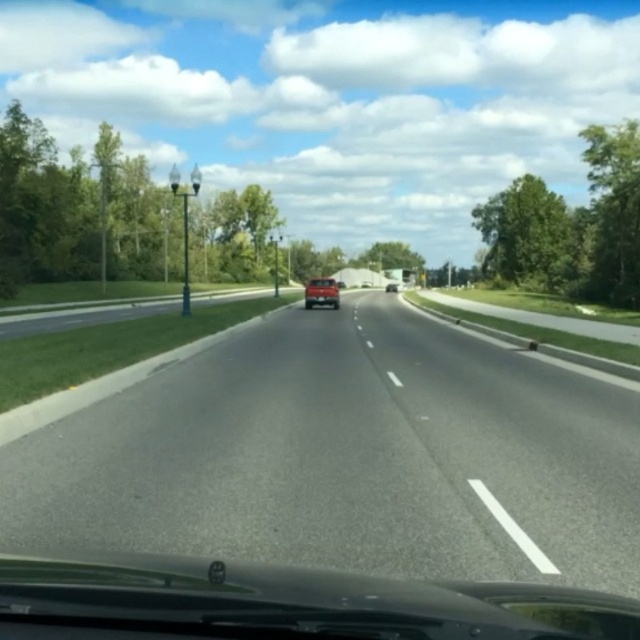
Question: Which object is closer to the camera taking this photo?

Choices:
 (A) asphalt road at center
 (B) matte black suv at center
 (C) shiny red car at center

Answer: (A)

Question: Which point is closer to the camera?

Choices:
 (A) (396, 289)
 (B) (10, 493)

Answer: (B)

Question: Is asphalt road at center wider than matte black suv at center?

Choices:
 (A) no
 (B) yes

Answer: (B)

Question: Is asphalt road at center wider than matte black suv at center?

Choices:
 (A) no
 (B) yes

Answer: (B)

Question: Where is asphalt road at center located in relation to shiny red car at center in the image?

Choices:
 (A) right
 (B) left

Answer: (A)

Question: Which of these objects is positioned farthest from the matte black suv at center?

Choices:
 (A) shiny red car at center
 (B) asphalt road at center

Answer: (B)